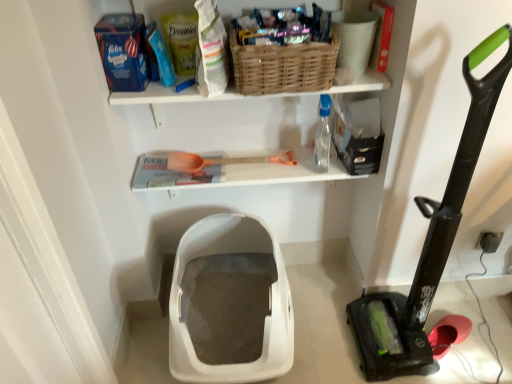
Identify the location of vacant area that lies to the right of black rubber vacuum at right. (466, 340).